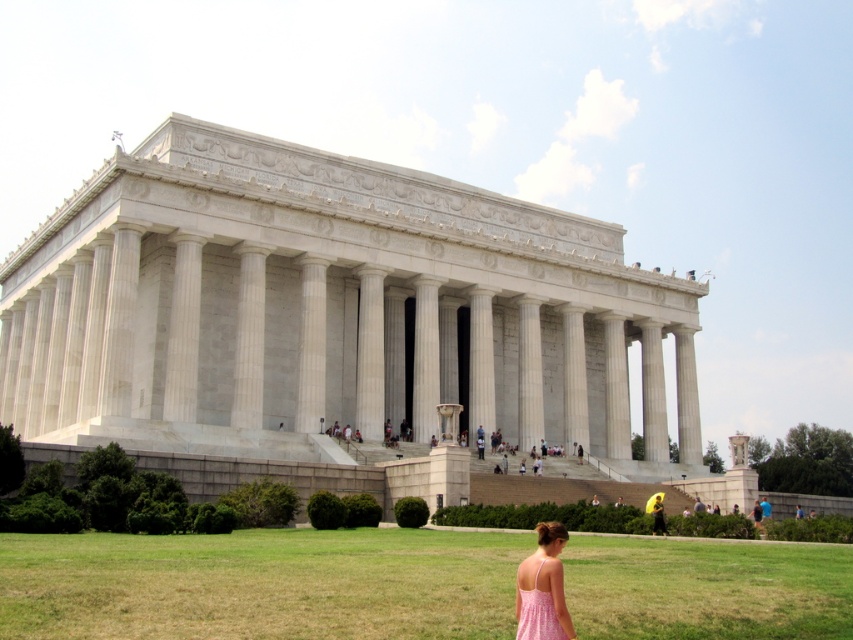
Question: Is green grass at lower center to the right of pink floral dress at lower right from the viewer's perspective?

Choices:
 (A) yes
 (B) no

Answer: (B)

Question: Which object is positioned farthest from the pink fabric dress at lower center?

Choices:
 (A) pink floral dress at lower right
 (B) green grass at lower center

Answer: (A)

Question: Which point is closer to the camera?

Choices:
 (A) (830, 604)
 (B) (654, 506)

Answer: (A)

Question: Which of the following is the closest to the observer?

Choices:
 (A) (529, 618)
 (B) (653, 506)

Answer: (A)

Question: Is green grass at lower center to the left of pink floral dress at lower right from the viewer's perspective?

Choices:
 (A) yes
 (B) no

Answer: (A)

Question: Does pink floral dress at lower right come behind pink fabric dress at lower center?

Choices:
 (A) no
 (B) yes

Answer: (A)